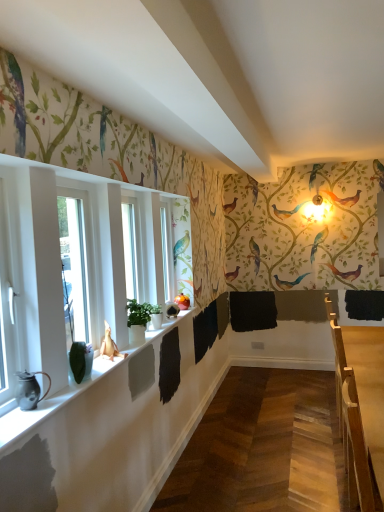
This screenshot has height=512, width=384. I want to click on white glossy window at left, so click(x=17, y=280).

Find the location of a particular element. This screenshot has height=512, width=384. wooden table at right is located at coordinates (360, 408).

What do you see at coordinates (106, 380) in the screenshot? I see `matte white window sill at lower left` at bounding box center [106, 380].

Image resolution: width=384 pixels, height=512 pixels. I want to click on green matte plant at left, so click(x=139, y=320).

Between point (362, 424) and point (9, 309), which one is positioned in front?

Point (362, 424)

In the image, is wooden table at right on the left side or the right side of white glossy window at left?

Clearly, wooden table at right is on the right of white glossy window at left in the image.

You are a GUI agent. You are given a task and a screenshot of the screen. Output one action in this format:
    pyautogui.click(x=<x>, y=<y>)
    Task: Click on the table below the white glossy window at left (from a real-world perspective)
    The width and height of the screenshot is (384, 512).
    Given the screenshot: What is the action you would take?
    (x=360, y=408)

Based on the photo, is wooden table at right far from white glossy window at left?

Yes, wooden table at right is far from white glossy window at left.

Is the surface of matte white window sill at lower left in direct contact with wooden table at right?

No.

Considering the positions of objects matte white window sill at lower left and wooden table at right in the image provided, who is behind, matte white window sill at lower left or wooden table at right?

wooden table at right is further away from the camera.

From their relative heights in the image, would you say matte white window sill at lower left is taller or shorter than wooden table at right?

Clearly, matte white window sill at lower left is shorter compared to wooden table at right.

Does matte white window sill at lower left turn towards wooden table at right?

No, matte white window sill at lower left is not turned towards wooden table at right.

Is point (369, 490) positioned in front of point (142, 320)?

Yes, point (369, 490) is closer to viewer.

Can you confirm if wooden table at right is wider than green matte plant at left?

Correct, the width of wooden table at right exceeds that of green matte plant at left.

From a real-world perspective, is wooden table at right beneath green matte plant at left?

Yes.

Is wooden table at right not close to green matte plant at left?

Absolutely, wooden table at right is distant from green matte plant at left.

Which is closer to the camera, (3,453) or (128,304)?

Point (3,453)

Who is smaller, matte white window sill at lower left or green matte plant at left?

Smaller between the two is green matte plant at left.

Could you tell me if matte white window sill at lower left is facing green matte plant at left?

No, matte white window sill at lower left is not oriented towards green matte plant at left.

Image resolution: width=384 pixels, height=512 pixels. In order to click on houseplant lying behind the matte white window sill at lower left in this screenshot , I will do `click(139, 320)`.

At what (x,y) coordinates should I click in order to perform the action: click on houseplant behind the wooden table at right. Please return your answer as a coordinate pair (x, y). The width and height of the screenshot is (384, 512). Looking at the image, I should click on (139, 320).

Considering the positions of objects green matte plant at left and wooden table at right in the image provided, who is more to the right, green matte plant at left or wooden table at right?

From the viewer's perspective, wooden table at right appears more on the right side.

Is green matte plant at left not near wooden table at right?

Absolutely, green matte plant at left is distant from wooden table at right.

Which of these two, green matte plant at left or wooden table at right, is wider?

With larger width is wooden table at right.

Does point (36, 364) come closer to viewer compared to point (103, 371)?

Yes, it is.

From a real-world perspective, is white glossy window at left positioned over matte white window sill at lower left based on gravity?

Yes.

Is white glossy window at left positioned in front of matte white window sill at lower left?

No, white glossy window at left is further to the viewer.

Are white glossy window at left and matte white window sill at lower left beside each other?

There is a gap between white glossy window at left and matte white window sill at lower left.

Is green matte plant at left positioned with its back to matte white window sill at lower left?

No, matte white window sill at lower left is not at the back of green matte plant at left.

Which is more to the left, green matte plant at left or matte white window sill at lower left?

matte white window sill at lower left.

From the picture: Is matte white window sill at lower left located within green matte plant at left?

No, matte white window sill at lower left is not surrounded by green matte plant at left.

From a real-world perspective, is green matte plant at left under matte white window sill at lower left?

No, from a real-world perspective, green matte plant at left is not below matte white window sill at lower left.

What are the coordinates of `window above the wooden table at right (from the image's perspective)` in the screenshot? It's located at (17, 280).

Find the location of `table behind the matte white window sill at lower left`. table behind the matte white window sill at lower left is located at coordinates (360, 408).

Based on the photo, from the image, which object appears to be farther from white glossy window at left, green matte plant at left or matte white window sill at lower left?

Based on the image, green matte plant at left appears to be further to white glossy window at left.

Consider the image. When comparing their distances from white glossy window at left, does green matte plant at left or wooden table at right seem further?

wooden table at right.

Based on their spatial positions, is white glossy window at left or matte white window sill at lower left further from green matte plant at left?

The object further to green matte plant at left is white glossy window at left.

In the scene shown: Considering their positions, is white glossy window at left positioned further to wooden table at right than matte white window sill at lower left?

The object further to wooden table at right is white glossy window at left.

Considering their positions, is green matte plant at left positioned further to matte white window sill at lower left than white glossy window at left?

Based on the image, white glossy window at left appears to be further to matte white window sill at lower left.

Looking at the image, which one is located further to wooden table at right, green matte plant at left or white glossy window at left?

white glossy window at left is positioned further to the anchor wooden table at right.

Looking at the image, which one is located further to wooden table at right, matte white window sill at lower left or green matte plant at left?

green matte plant at left is positioned further to the anchor wooden table at right.

Which object lies nearer to the anchor point green matte plant at left, white glossy window at left or wooden table at right?

white glossy window at left is closer to green matte plant at left.

I want to click on window sill between white glossy window at left and wooden table at right in the horizontal direction, so click(x=106, y=380).

Where is `houseplant between white glossy window at left and wooden table at right in the horizontal direction`? houseplant between white glossy window at left and wooden table at right in the horizontal direction is located at coordinates (139, 320).

Locate an element on the screen. window between matte white window sill at lower left and green matte plant at left along the z-axis is located at coordinates (17, 280).

The width and height of the screenshot is (384, 512). What are the coordinates of `houseplant situated between matte white window sill at lower left and wooden table at right from left to right` in the screenshot? It's located at (139, 320).